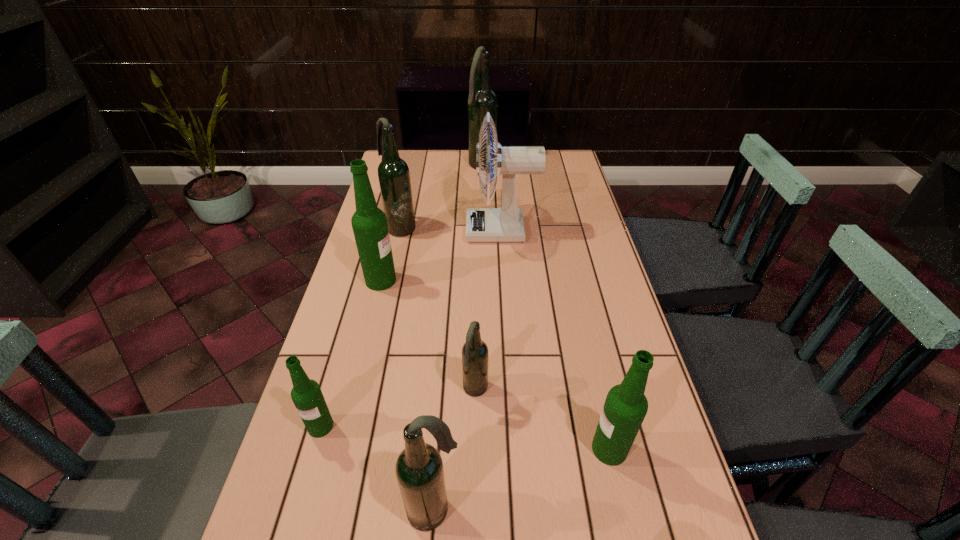
This screenshot has width=960, height=540. Identify the location of object that can be found as the fifth closest to the rightmost green beer bottle. (369, 223).

Identify which beer bottle is the fifth nearest to the fan. Please provide its 2D coordinates. Your answer should be formatted as a tuple, i.e. [(x, y)], where the tuple contains the x and y coordinates of a point satisfying the conditions above.

[(625, 407)]

Point out which beer bottle is positioned as the sixth nearest to the farthest beer bottle. Please provide its 2D coordinates. Your answer should be formatted as a tuple, i.e. [(x, y)], where the tuple contains the x and y coordinates of a point satisfying the conditions above.

[(419, 469)]

Locate an element on the screen. The width and height of the screenshot is (960, 540). dark beer bottle identified as the fourth closest to the rightmost beer bottle is located at coordinates (x=482, y=99).

You are a GUI agent. You are given a task and a screenshot of the screen. Output one action in this format:
    pyautogui.click(x=<x>, y=<y>)
    Task: Click on the dark beer bottle that stands as the closest to the second nearest dark beer bottle
    
    Given the screenshot: What is the action you would take?
    pyautogui.click(x=419, y=469)

Locate an element on the screen. The image size is (960, 540). the second closest green beer bottle to the second biggest dark beer bottle is located at coordinates (306, 394).

Find the location of a particular element. green beer bottle that is the second closest to the biggest green beer bottle is located at coordinates (625, 407).

Where is `vacant position in the image that satisfies the following two spatial constraints: 1. on the back side of the biggest dark beer bottle; 2. on the left side of the third farthest dark beer bottle`? This screenshot has width=960, height=540. vacant position in the image that satisfies the following two spatial constraints: 1. on the back side of the biggest dark beer bottle; 2. on the left side of the third farthest dark beer bottle is located at coordinates (477, 166).